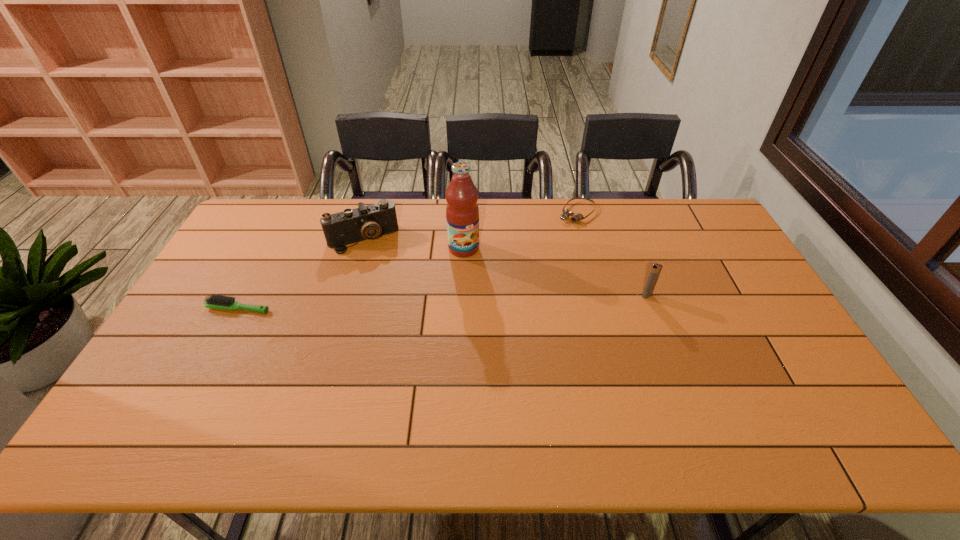
Identify the location of free spot on the desktop that is between the nearest object and the igniter and is positioned on the front label of the third object from right to left. (492, 300).

This screenshot has height=540, width=960. What are the coordinates of `free space on the desktop that is between the hairbrush and the second nearest object and is positioned on the front-facing side of the second object from left to right` in the screenshot? It's located at pos(389,303).

You are a GUI agent. You are given a task and a screenshot of the screen. Output one action in this format:
    pyautogui.click(x=<x>, y=<y>)
    Task: Click on the vacant space on the desktop that is between the nearest object and the second nearest object and is positioned on the front lenses and sides of the fourth object from left to right
    The image size is (960, 540).
    Given the screenshot: What is the action you would take?
    pyautogui.click(x=492, y=300)